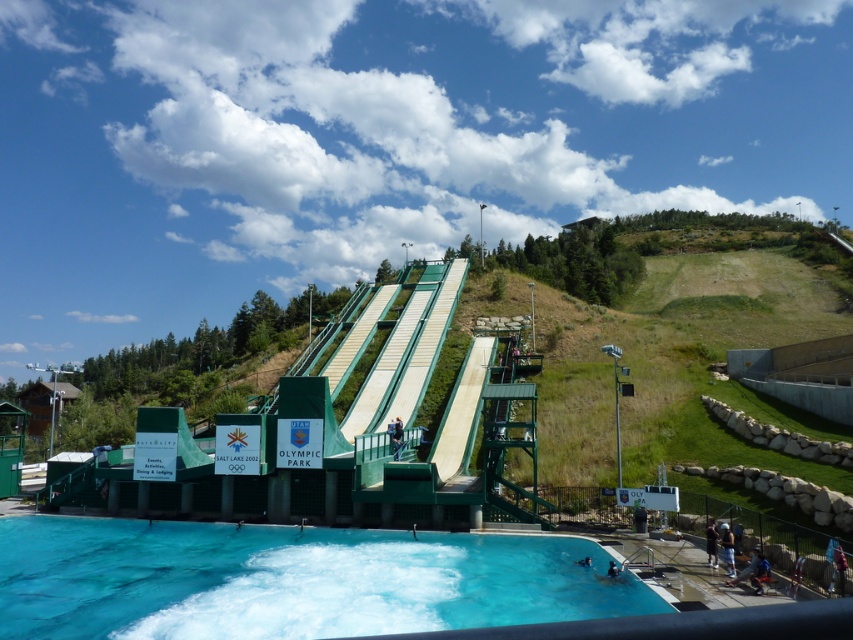
You are a photographer at the Utah Olympic Park and want to capture a photo of the dark blue shirt at lower right and light blue denim shorts at lower right. Which object is located more to the left side of the other?

The dark blue shirt at lower right is positioned on the left side of light blue denim shorts at lower right.

You are a photographer at the Utah Olympic Park. You need to capture a photo of the dark blue fabric jacket at center and the dark blue wetsuit at lower center. Which object should you focus on first if you want to include both in your frame without moving the camera?

The dark blue fabric jacket at center is much taller than the dark blue wetsuit at lower center, so you should focus on the dark blue fabric jacket at center first to ensure it fits within the frame.